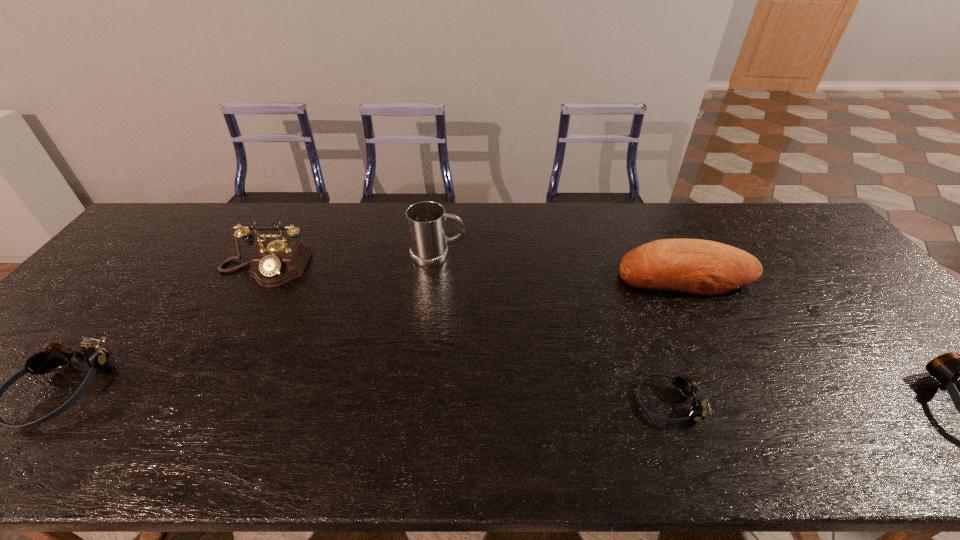
This screenshot has width=960, height=540. I want to click on the shortest goggles, so [687, 387].

Locate an element on the screen. Image resolution: width=960 pixels, height=540 pixels. the second goggles from right to left is located at coordinates (687, 387).

What are the coordinates of `the third object from left to right` in the screenshot? It's located at (426, 223).

This screenshot has width=960, height=540. I want to click on bread, so click(703, 267).

Locate an element on the screen. telephone is located at coordinates (277, 262).

Find the location of a particular element. free spot located through the lenses of the shortest goggles is located at coordinates (561, 402).

At what (x,y) coordinates should I click in order to perform the action: click on vacant area situated through the lenses of the shortest goggles. Please return your answer as a coordinate pair (x, y). The image size is (960, 540). Looking at the image, I should click on (489, 402).

Find the location of a particular element. This screenshot has width=960, height=540. vacant space located through the lenses of the shortest goggles is located at coordinates pyautogui.click(x=529, y=402).

Where is `free space located 0.270m on the side of the third object from left to right with the handle`? free space located 0.270m on the side of the third object from left to right with the handle is located at coordinates (553, 256).

Where is `free point located 0.150m on the front of the bread`? The height and width of the screenshot is (540, 960). free point located 0.150m on the front of the bread is located at coordinates (718, 339).